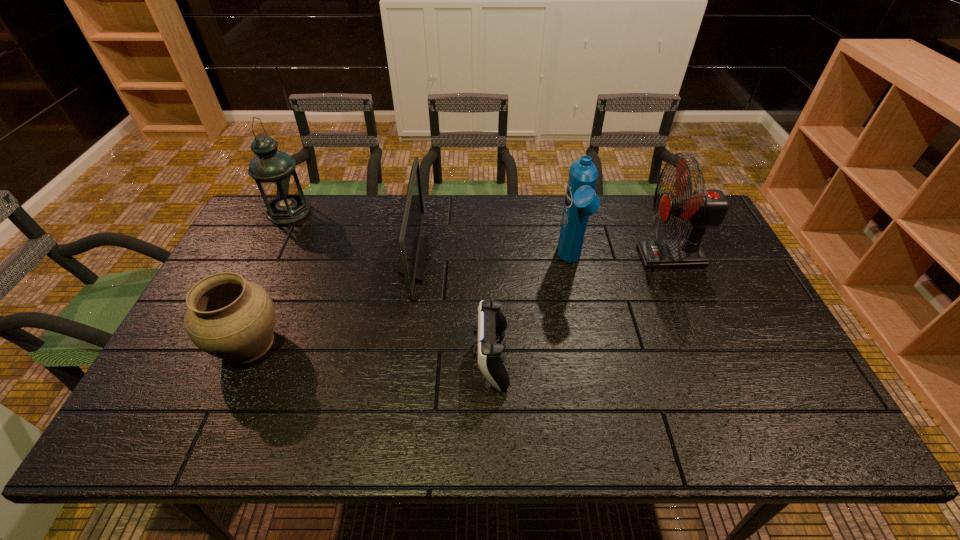
Where is `monitor that is at the far edge`? Image resolution: width=960 pixels, height=540 pixels. monitor that is at the far edge is located at coordinates (412, 246).

The image size is (960, 540). Find the location of `oil lamp that is at the left edge`. oil lamp that is at the left edge is located at coordinates (274, 171).

Image resolution: width=960 pixels, height=540 pixels. I want to click on urn that is positioned at the left edge, so click(x=230, y=318).

You are a GUI agent. You are given a task and a screenshot of the screen. Output one action in this format:
    pyautogui.click(x=<x>, y=<y>)
    Task: Click on the object positioned at the right edge
    This screenshot has width=960, height=540.
    Given the screenshot: What is the action you would take?
    click(x=704, y=208)

Where is `object present at the far left corner`? object present at the far left corner is located at coordinates click(x=274, y=171).

The width and height of the screenshot is (960, 540). Find the location of `object present at the far right corner`. object present at the far right corner is located at coordinates (704, 208).

Where is `vacant space at the far edge`? The height and width of the screenshot is (540, 960). vacant space at the far edge is located at coordinates (383, 201).

In the image, there is a desktop. At what (x,y) coordinates should I click in order to perform the action: click on vacant space at the near edge. Please return your answer as a coordinate pair (x, y). This screenshot has width=960, height=540. Looking at the image, I should click on (355, 446).

This screenshot has height=540, width=960. I want to click on vacant space at the left edge of the desktop, so click(257, 246).

In the image, there is a desktop. Identify the location of free space at the right edge. (755, 334).